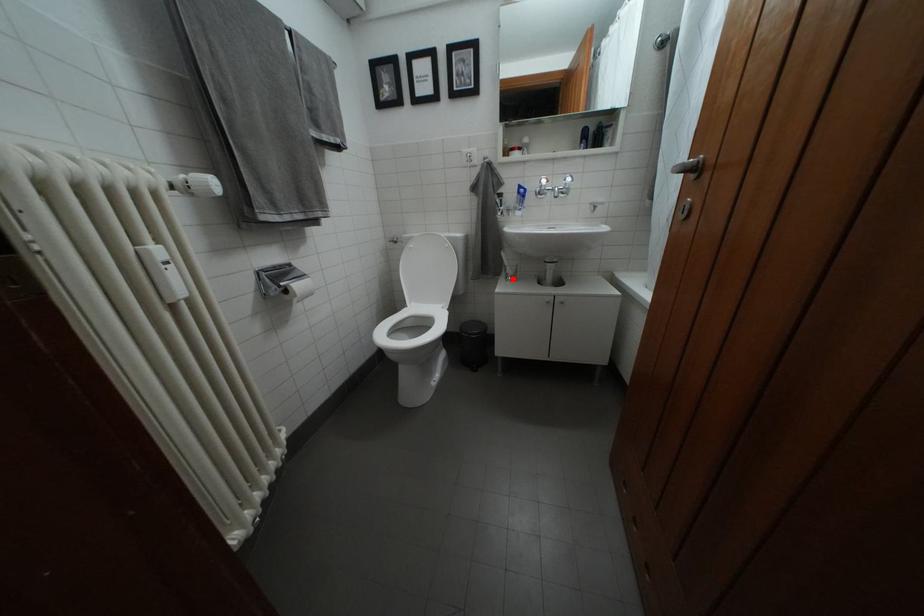
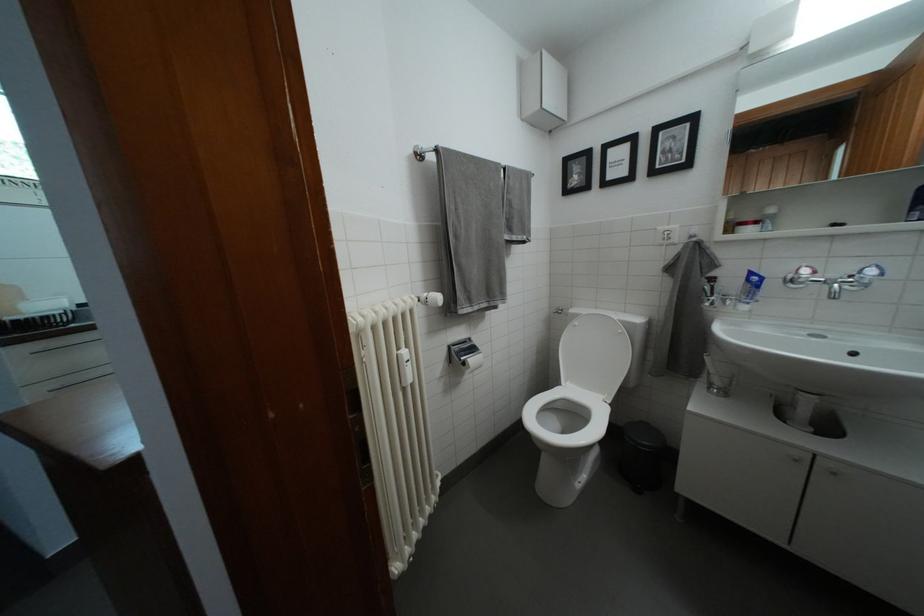
In the second image, find the point that corresponds to the highlighted location in the first image.

(714, 382)